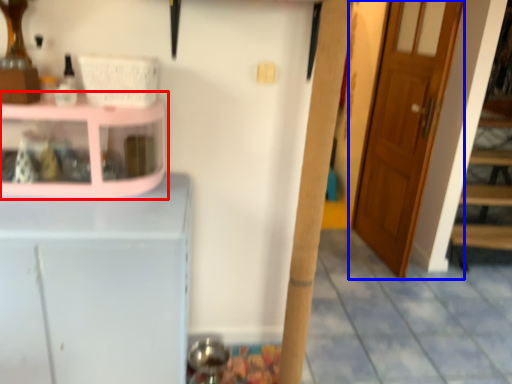
Question: Among these objects, which one is farthest to the camera, shelf (highlighted by a red box) or door (highlighted by a blue box)?

Choices:
 (A) shelf
 (B) door

Answer: (B)